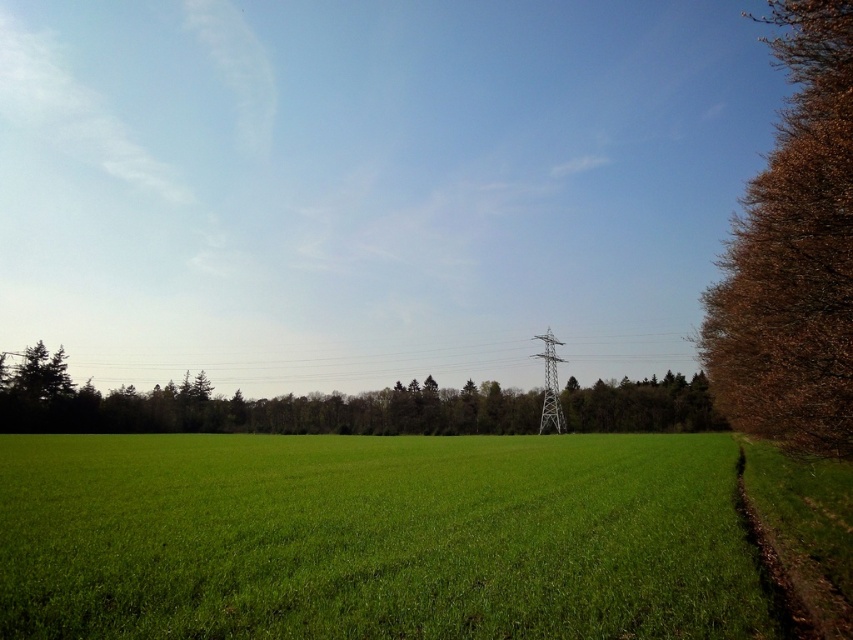
Between green grassy field at lower center and metallic silver power line at center, which one has less height?

green grassy field at lower center is shorter.

Who is positioned more to the right, green grassy field at lower center or metallic silver power line at center?

Positioned to the right is green grassy field at lower center.

Does point (672, 554) come behind point (131, 372)?

No, it is in front of (131, 372).

Image resolution: width=853 pixels, height=640 pixels. What are the coordinates of `green grassy field at lower center` in the screenshot? It's located at (375, 538).

Does green grassy field at lower center have a lesser width compared to brown textured tree at right?

Yes.

Is green grassy field at lower center smaller than brown textured tree at right?

Indeed, green grassy field at lower center has a smaller size compared to brown textured tree at right.

Does point (294, 614) come behind point (775, 166)?

No, (294, 614) is in front of (775, 166).

Find the location of a particular element. The width and height of the screenshot is (853, 640). green grassy field at lower center is located at coordinates (375, 538).

Does point (848, 333) come in front of point (126, 362)?

Yes, it is in front of point (126, 362).

Does brown textured tree at right have a larger size compared to metallic silver power line at center?

Yes, brown textured tree at right is bigger than metallic silver power line at center.

Which is behind, point (817, 340) or point (407, 360)?

The point (407, 360) is more distant.

Where is `brown textured tree at right`? brown textured tree at right is located at coordinates (793, 252).